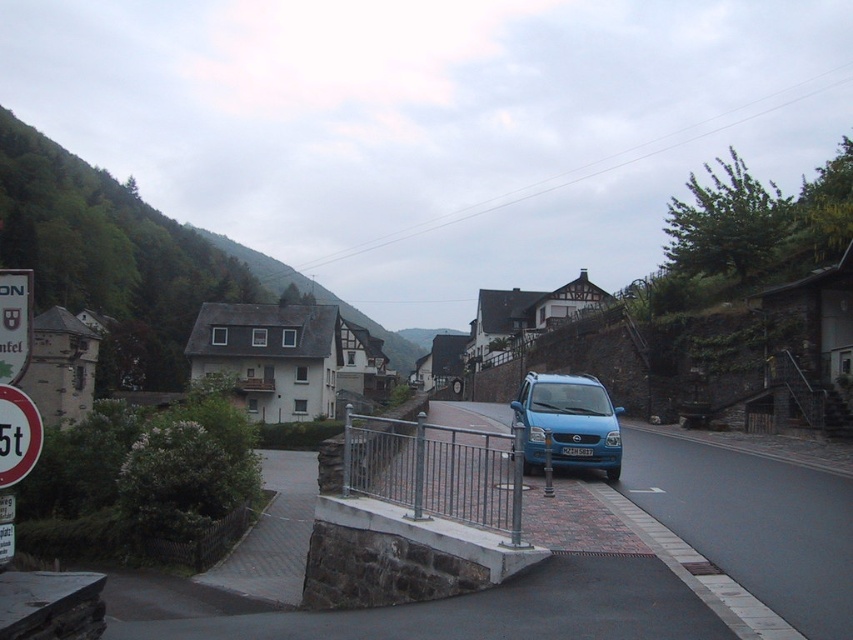
Does metallic gray rail at center have a lesser width compared to blue matte van at center?

No.

Which of these two, metallic gray rail at center or blue matte van at center, stands shorter?

Standing shorter between the two is blue matte van at center.

Between point (451, 490) and point (579, 461), which one is positioned in front?

Point (451, 490)

Image resolution: width=853 pixels, height=640 pixels. Identify the location of metallic gray rail at center. (436, 472).

How much distance is there between green leafy hillside at upper left and white plastic sign at upper left?

The distance of green leafy hillside at upper left from white plastic sign at upper left is 185.66 meters.

The width and height of the screenshot is (853, 640). What do you see at coordinates (119, 256) in the screenshot?
I see `green leafy hillside at upper left` at bounding box center [119, 256].

Find the location of a particular element. The image size is (853, 640). green leafy hillside at upper left is located at coordinates (119, 256).

At what (x,y) coordinates should I click in order to perform the action: click on green leafy hillside at upper left. Please return your answer as a coordinate pair (x, y). Looking at the image, I should click on (119, 256).

Between green leafy hillside at upper left and metallic gray rail at center, which one appears on the right side from the viewer's perspective?

Positioned to the right is metallic gray rail at center.

The width and height of the screenshot is (853, 640). What do you see at coordinates (119, 256) in the screenshot? I see `green leafy hillside at upper left` at bounding box center [119, 256].

At what (x,y) coordinates should I click in order to perform the action: click on green leafy hillside at upper left. Please return your answer as a coordinate pair (x, y). Image resolution: width=853 pixels, height=640 pixels. Looking at the image, I should click on (119, 256).